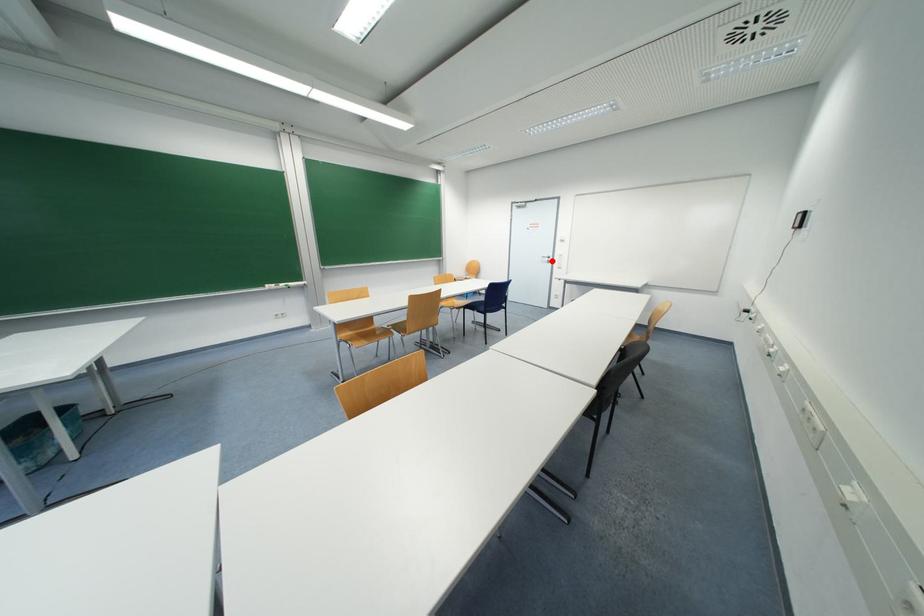
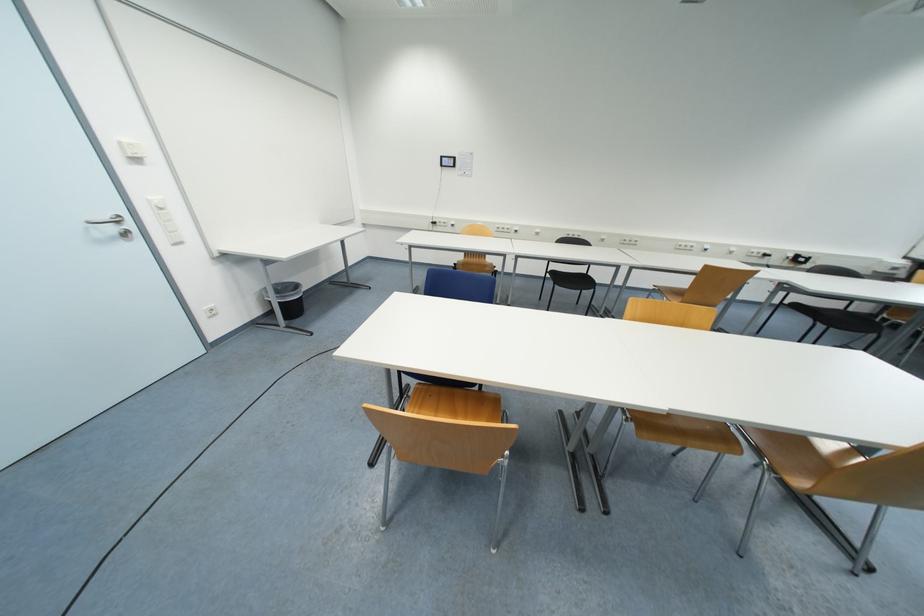
In the second image, find the point that corresponds to the highlighted location in the first image.

(117, 230)